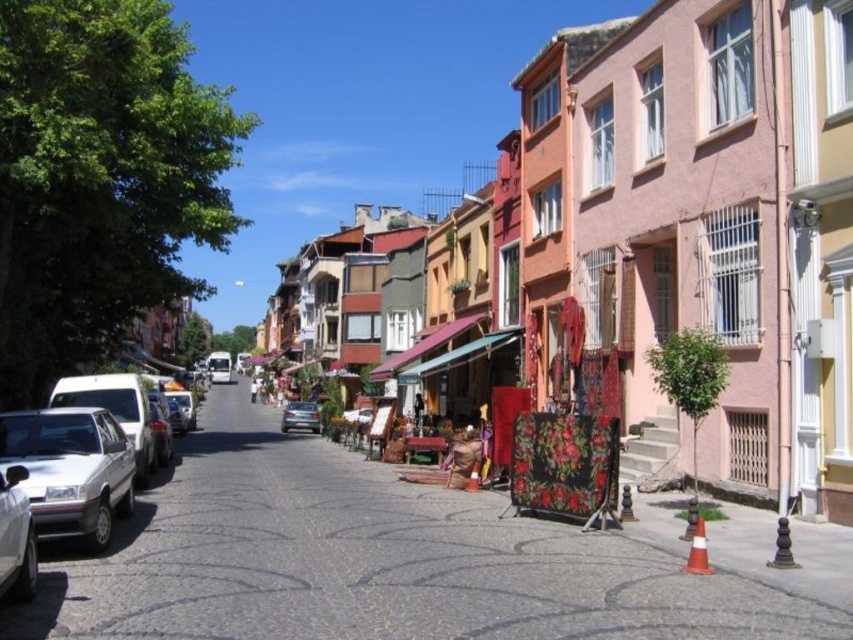
Who is positioned more to the right, floral-patterned fabric at center or floral fabric stall at center?

floral-patterned fabric at center is more to the right.

Does floral-patterned fabric at center lie in front of floral fabric stall at center?

Yes, it is in front of floral fabric stall at center.

Where is `floral-patterned fabric at center`? floral-patterned fabric at center is located at coordinates (698, 225).

Locate an element on the screen. silver metallic car at lower left is located at coordinates (16, 538).

In the scene shown: Does silver metallic car at lower left appear on the right side of floral fabric stall at center?

In fact, silver metallic car at lower left is to the left of floral fabric stall at center.

Does point (28, 548) lie in front of point (454, 321)?

Yes, point (28, 548) is in front of point (454, 321).

This screenshot has height=640, width=853. I want to click on silver metallic car at lower left, so click(x=16, y=538).

Does floral-patterned fabric at center have a greater width compared to satin silver sedan at center?

Yes.

The height and width of the screenshot is (640, 853). What are the coordinates of `floral-patterned fabric at center` in the screenshot? It's located at (698, 225).

Find the location of a particular element. floral-patterned fabric at center is located at coordinates (698, 225).